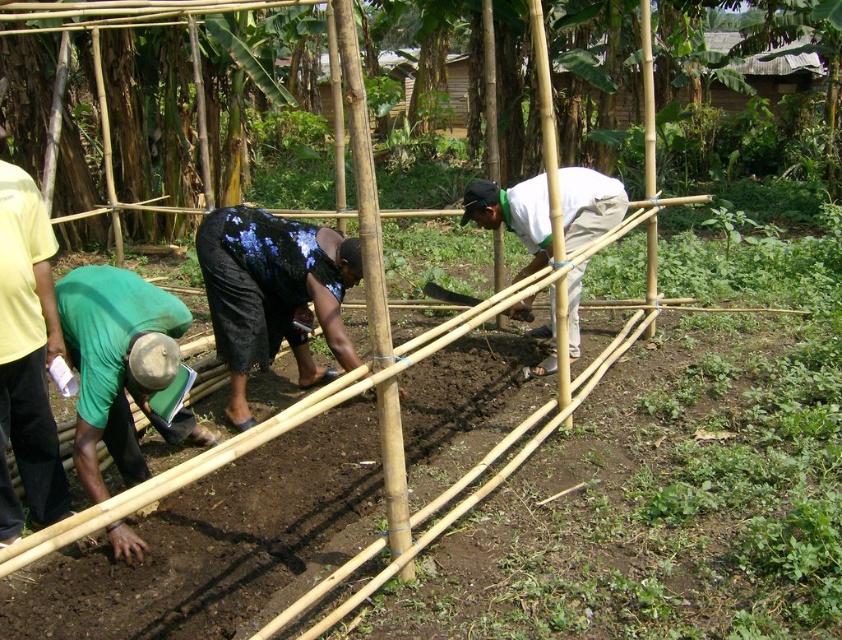
Question: Which of these objects is positioned closest to the black sequined dress at center?

Choices:
 (A) green fabric shirt at lower left
 (B) smooth wooden shovel at center

Answer: (A)

Question: Is black sequined dress at center smaller than smooth wooden shovel at center?

Choices:
 (A) no
 (B) yes

Answer: (A)

Question: Can you confirm if black sequined dress at center is positioned below white cotton shirt at center?

Choices:
 (A) yes
 (B) no

Answer: (A)

Question: Which point is farther to the camera?

Choices:
 (A) green fabric shirt at left
 (B) black sequined dress at center
 (C) white cotton shirt at center
 (D) green fabric shirt at lower left

Answer: (B)

Question: Which object appears farthest from the camera in this image?

Choices:
 (A) green fabric shirt at left
 (B) black sequined dress at center

Answer: (B)

Question: Is black sequined dress at center bigger than green fabric shirt at left?

Choices:
 (A) no
 (B) yes

Answer: (B)